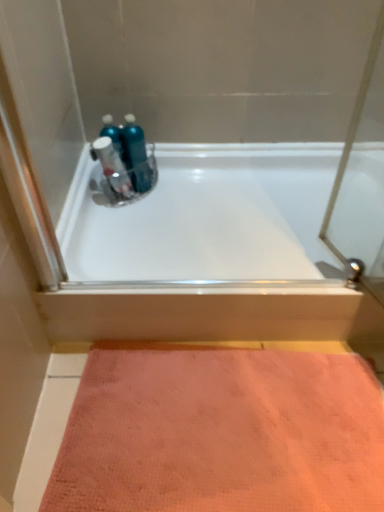
Locate an element on the screen. free spot in front of blue glossy mouthwash at center is located at coordinates pyautogui.click(x=146, y=210).